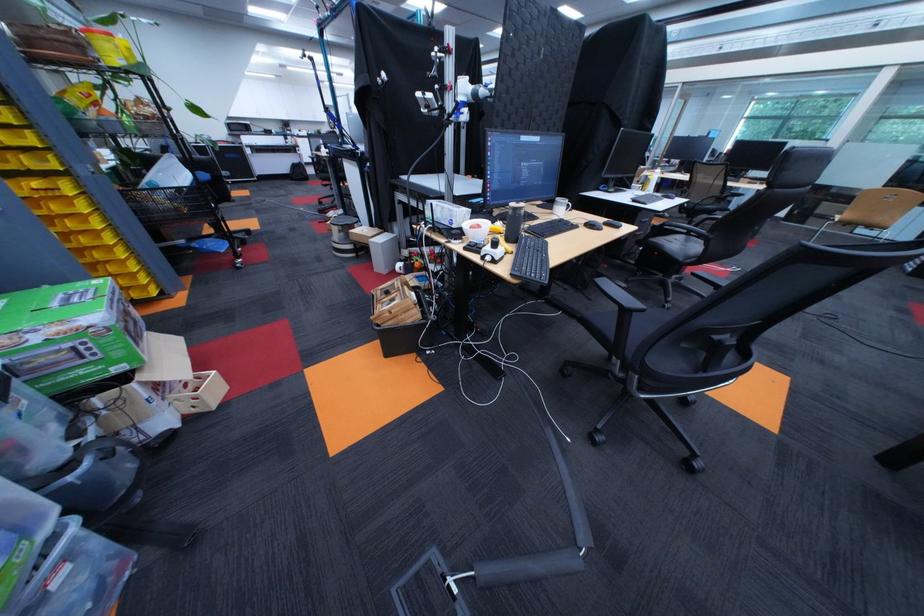
The height and width of the screenshot is (616, 924). What do you see at coordinates (394, 304) in the screenshot?
I see `a wooden crate handle` at bounding box center [394, 304].